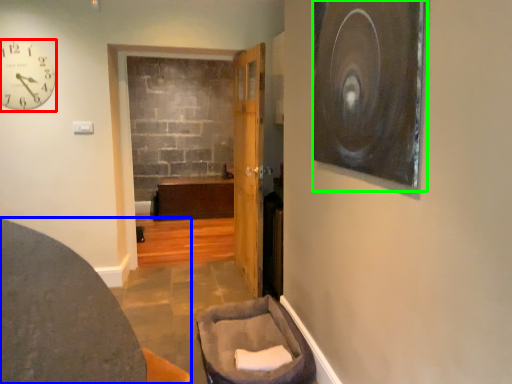
Question: Estimate the real-world distances between objects in this image. Which object is farther from clock (highlighted by a red box), furniture (highlighted by a blue box) or picture frame (highlighted by a green box)?

Choices:
 (A) furniture
 (B) picture frame

Answer: (B)